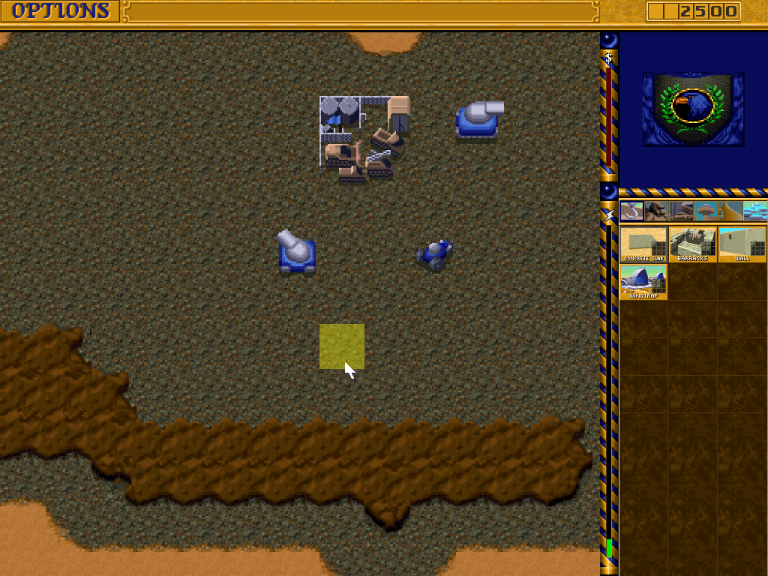
Image resolution: width=768 pixels, height=576 pixels. Find the location of `brown column`. brown column is located at coordinates (723, 367).